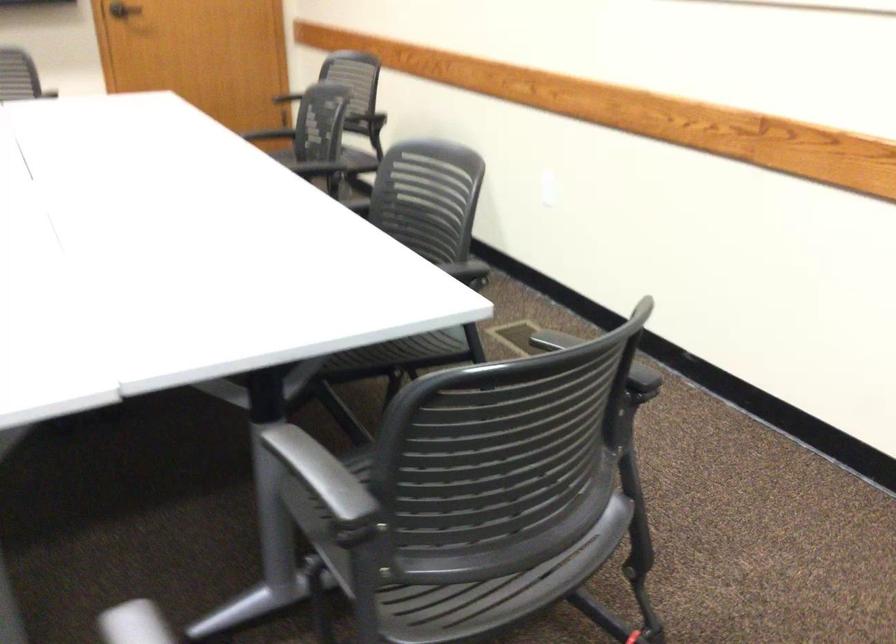
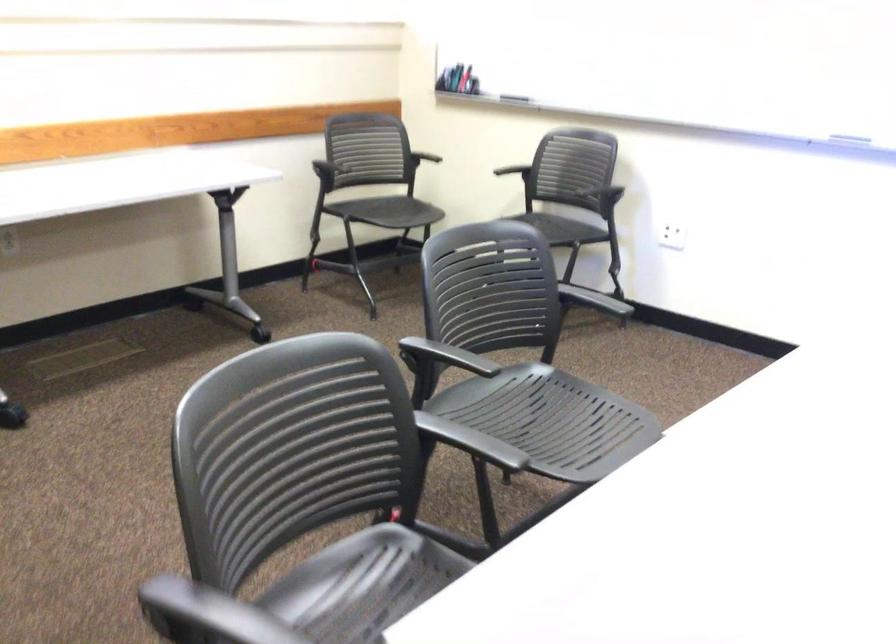
The point at (304,476) is marked in the first image. Where is the corresponding point in the second image?

(471, 442)